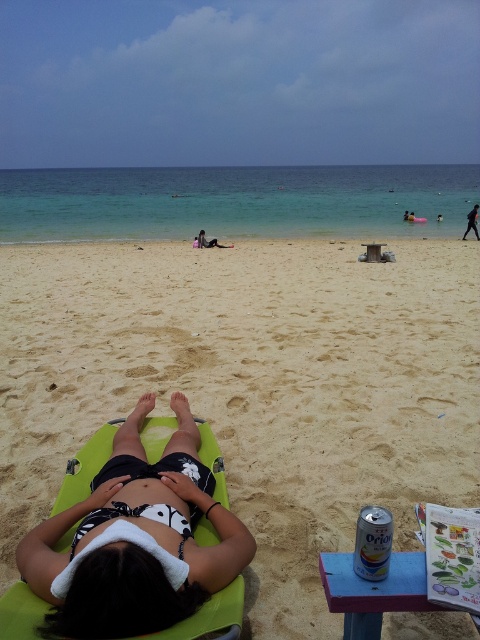
You are a photographer trying to capture a shot of the green fabric beach chair at lower left and the dark blue fabric shorts at center. From your current position, which object is positioned lower in the frame?

The green fabric beach chair at lower left is positioned below the dark blue fabric shorts at center, so the green fabric beach chair at lower left is lower in the frame.

You are standing at the point labeled as point (475, 225) and want to walk to the point labeled as point (240, 611). According to the scene, which direction should you move relative to your current position?

You should move forward because point (240, 611) is in front of point (475, 225).

You are a photographer standing at the edge of the beach, wanting to take a photo of the wooden picnic table at center and the dark blue fabric at center. Based on their positions, which object will appear closer to the camera in the photo?

The wooden picnic table at center will appear closer to the camera in the photo because it is positioned in front of the dark blue fabric at center according to the description.